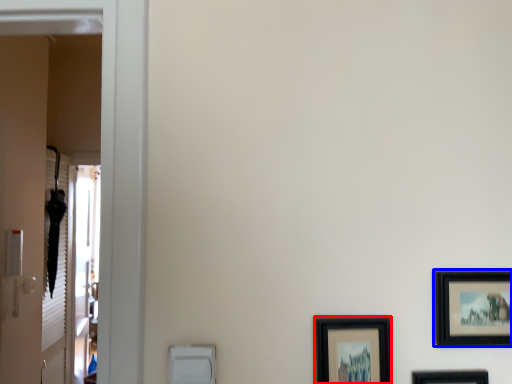
Question: Which object appears farthest to the camera in this image, picture frame (highlighted by a red box) or picture frame (highlighted by a blue box)?

Choices:
 (A) picture frame
 (B) picture frame

Answer: (B)